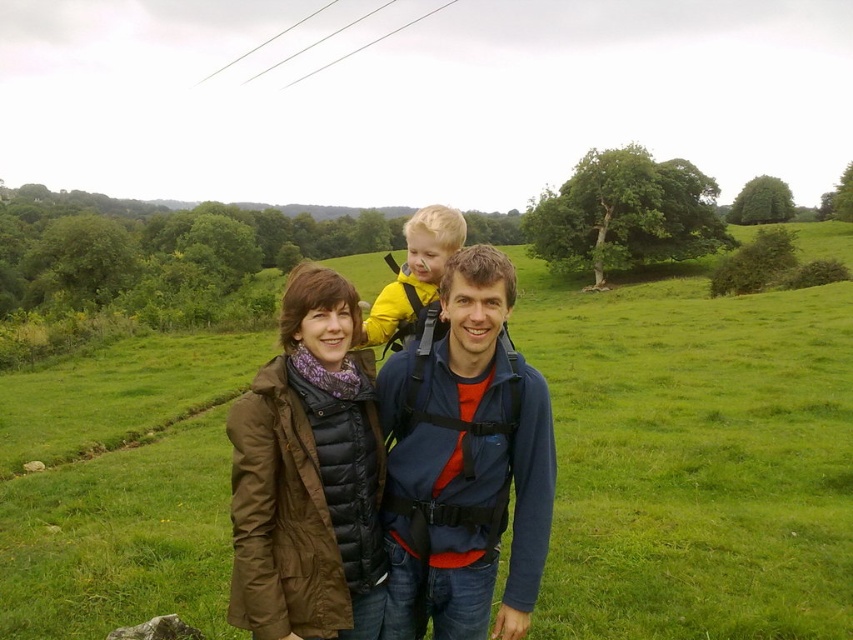
You are a hiker planning to carry both the blue fabric backpack at center and the brown quilted jacket at center. Based on their sizes, can you determine which item you should place first into your storage compartment to ensure both fit?

The blue fabric backpack at center might be wider than brown quilted jacket at center, so you should place the wider blue fabric backpack at center first to ensure both items fit into the storage compartment.

You are planning to take a photo of the family while ensuring the blue fabric backpack at center is clearly visible. Given the backpack is at coordinates point 0.725, 0.546, where should you position the camera relative to the family to capture it in the frame?

The blue fabric backpack at center is located at point (465, 464), so positioning the camera directly facing the center of the family group will ensure the backpack is clearly visible in the frame.

You are a photographer trying to capture a candid shot of the family. The brown quilted jacket at center and the yellow fabric baby carrier at center are both in your viewfinder. Which object is closer to the camera?

The brown quilted jacket at center is positioned under the yellow fabric baby carrier at center, meaning it is closer to the camera.